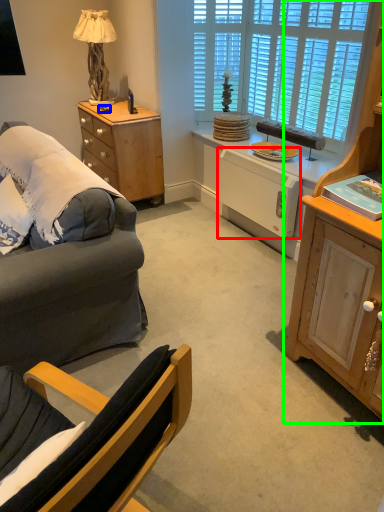
Question: Which object is the farthest from appliance (highlighted by a red box)? Choose among these: remote control (highlighted by a blue box) or cabinetry (highlighted by a green box).

Choices:
 (A) remote control
 (B) cabinetry

Answer: (A)